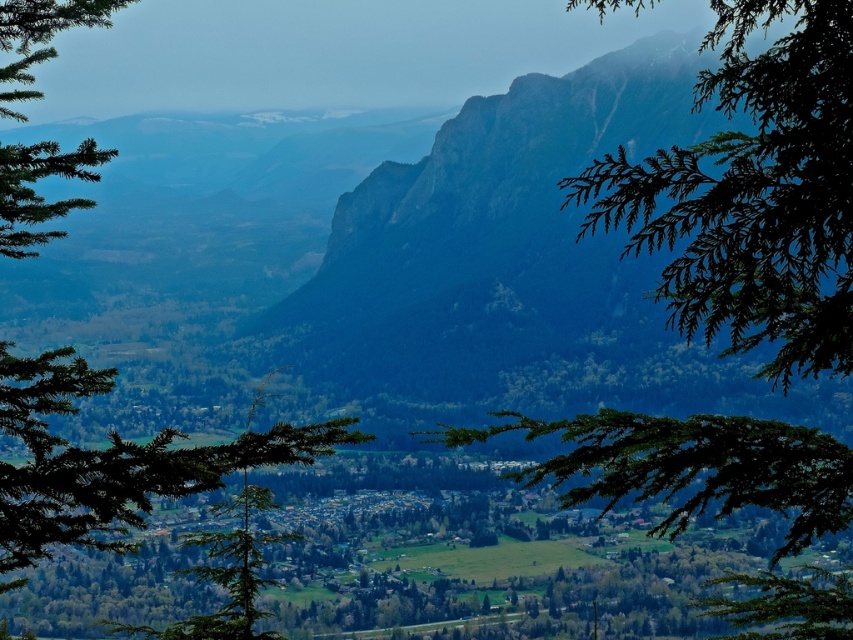
You are a hiker who wants to take a photo of the green matte tree at center from the green leafy branch at upper right. Given that your camera has a maximum focus range of 20 meters, will you be able to capture a clear image of the tree?

The green leafy branch at upper right is 22.92 meters from the green matte tree at center. Since the distance exceeds the camera maximum focus range of 20 meters, you won

You are an observer looking at the mountain landscape. You notice a point marked at coordinates (753, 193). What object in the scene does this point correspond to?

The point at coordinates (753, 193) corresponds to the green leafy branch at upper right.